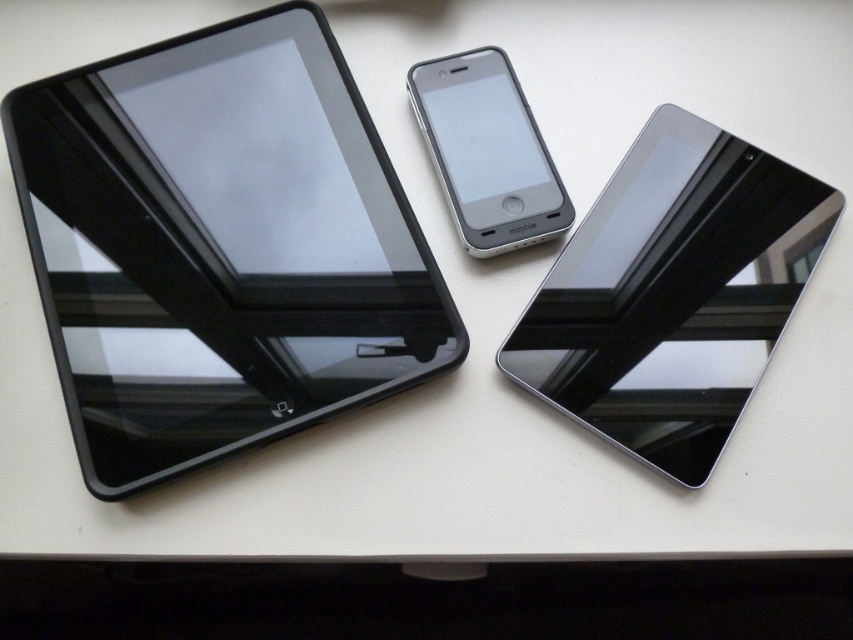
Question: Is glossy black tablet at center in front of matte black tablet at center?

Choices:
 (A) no
 (B) yes

Answer: (B)

Question: Estimate the real-world distances between objects in this image. Which object is closer to the black glossy tablet at left?

Choices:
 (A) matte black tablet at center
 (B) glossy black tablet at center

Answer: (A)

Question: Which object appears farthest from the camera in this image?

Choices:
 (A) matte black tablet at center
 (B) glossy black tablet at center

Answer: (A)

Question: Can you confirm if black glossy tablet at left is positioned above glossy black tablet at center?

Choices:
 (A) no
 (B) yes

Answer: (B)

Question: Which point is farther to the camera?

Choices:
 (A) (555, 172)
 (B) (320, 413)

Answer: (A)

Question: Is black glossy tablet at left further to camera compared to glossy black tablet at center?

Choices:
 (A) no
 (B) yes

Answer: (A)